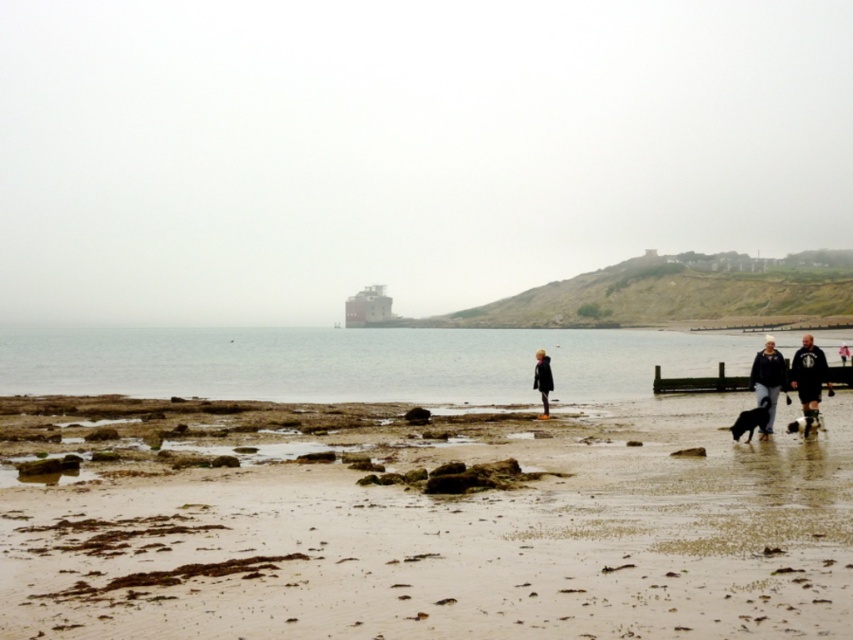
Question: Which of the following is the farthest from the observer?

Choices:
 (A) (538, 372)
 (B) (454, 371)

Answer: (B)

Question: Which object is positioned farthest from the sandy beach at lower center?

Choices:
 (A) dark gray hoodie at lower right
 (B) metallic gray boat at center
 (C) matte red building at center

Answer: (C)

Question: Can you confirm if sandy beach at lower center is positioned below dark gray hoodie at lower right?

Choices:
 (A) yes
 (B) no

Answer: (A)

Question: Among these objects, which one is nearest to the camera?

Choices:
 (A) matte red building at center
 (B) clear water at lower left
 (C) sandy beach at lower center

Answer: (C)

Question: Is sandy beach at lower center above dark matte coat at center?

Choices:
 (A) no
 (B) yes

Answer: (A)

Question: Observing the image, what is the correct spatial positioning of matte red building at center in reference to dark blue jacket at lower right?

Choices:
 (A) right
 (B) left

Answer: (B)